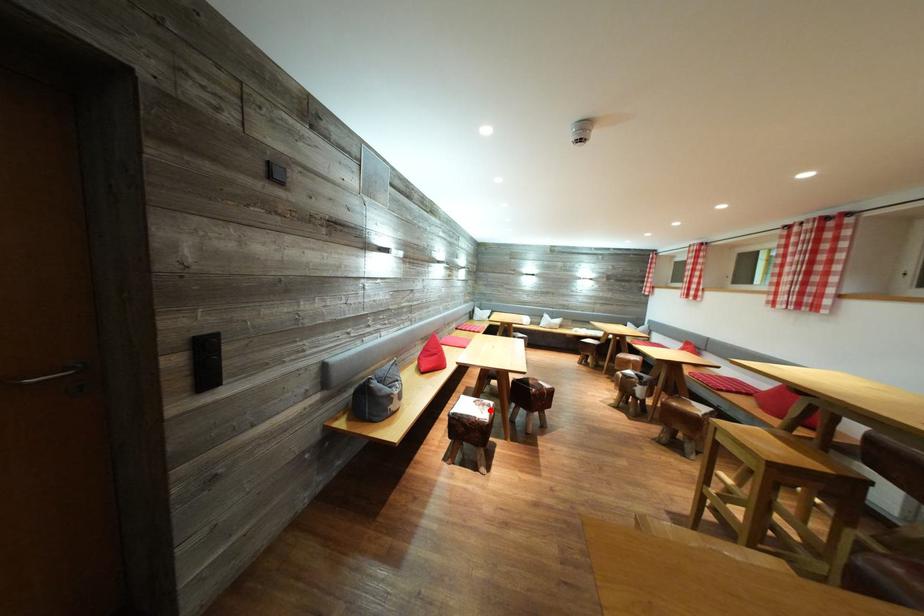
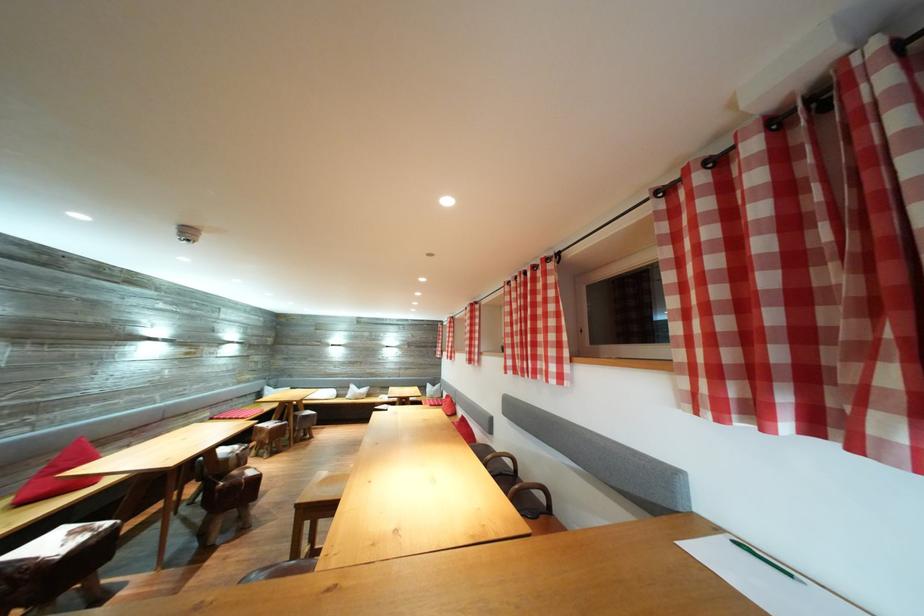
Where in the second image is the point corresponding to the highlighted location from the first image?

(91, 536)